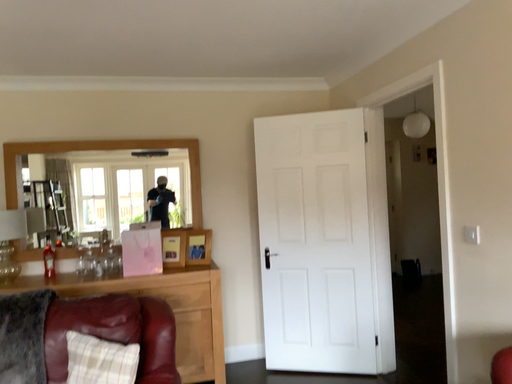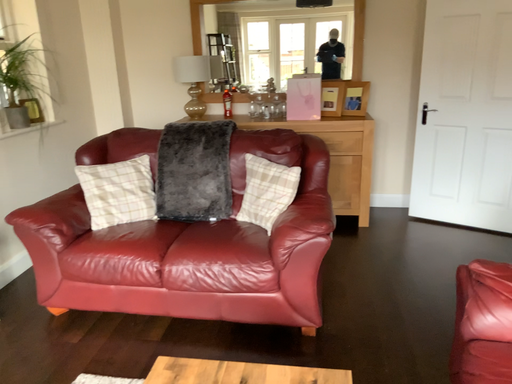
Question: How did the camera likely rotate when shooting the video?

Choices:
 (A) rotated right
 (B) rotated left

Answer: (B)